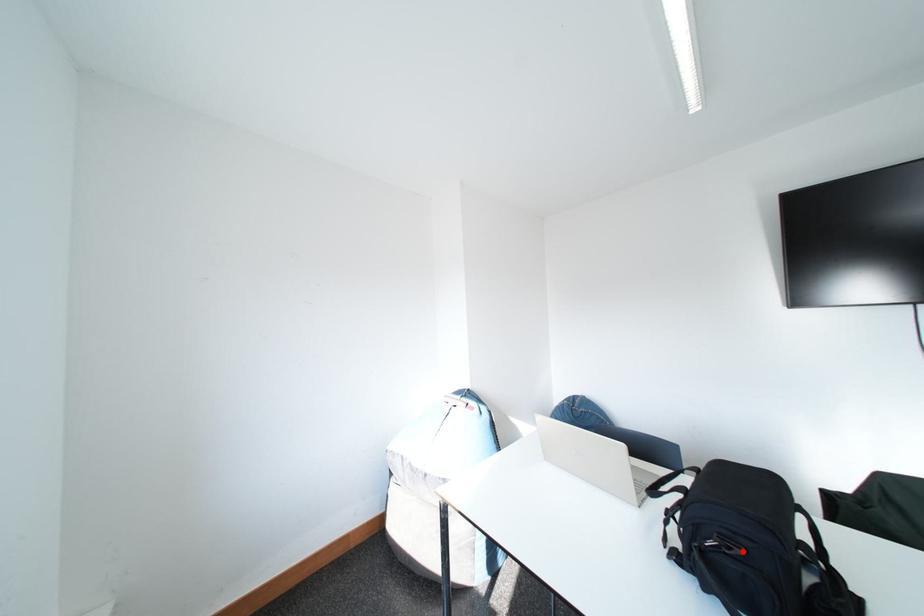
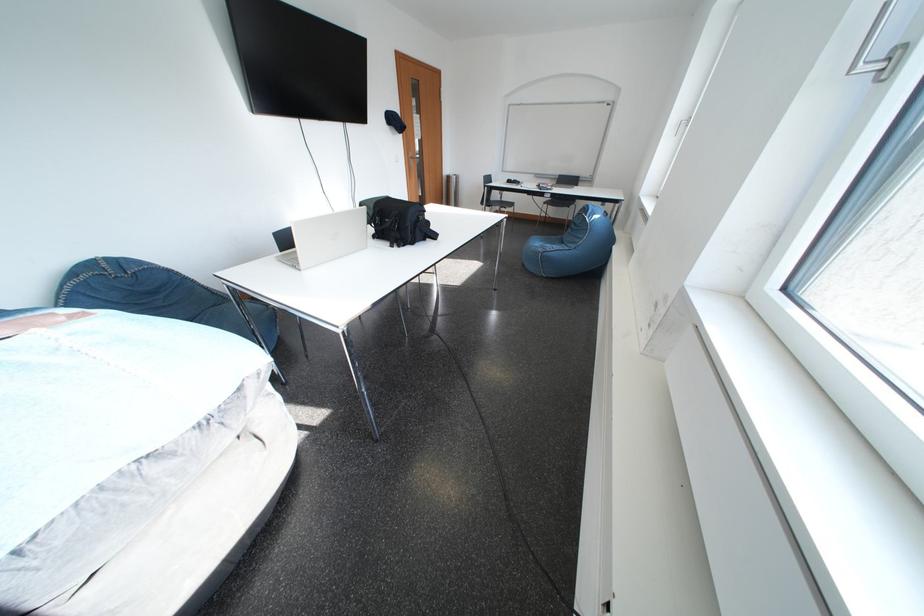
Question: I am providing you with two images of the same scene from different viewpoints. A red point is marked on the first image. Can you still see the location of the red point in image 2?

Choices:
 (A) Yes
 (B) No

Answer: (B)